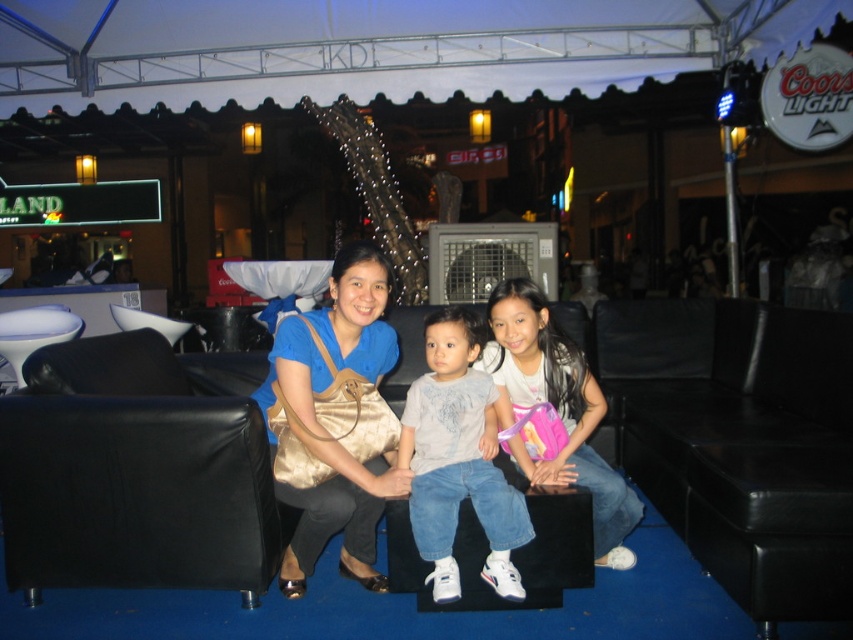
Question: Is black leather couch at center bigger than white cotton shirt at center?

Choices:
 (A) no
 (B) yes

Answer: (B)

Question: Which object is positioned farthest from the gold satin purse at center?

Choices:
 (A) pink fabric backpack at center
 (B) black leather couch at lower right

Answer: (B)

Question: From the image, what is the correct spatial relationship of white cotton shirt at center in relation to pink fabric backpack at center?

Choices:
 (A) right
 (B) left

Answer: (B)

Question: Which object is the closest to the black leather couch at center?

Choices:
 (A) pink fabric backpack at center
 (B) white cotton shirt at center

Answer: (B)

Question: Does black leather couch at center appear on the left side of pink fabric backpack at center?

Choices:
 (A) yes
 (B) no

Answer: (A)

Question: Which point is farther to the camera?

Choices:
 (A) (68, 516)
 (B) (728, 317)
 (C) (486, 412)
 (D) (378, 486)

Answer: (B)